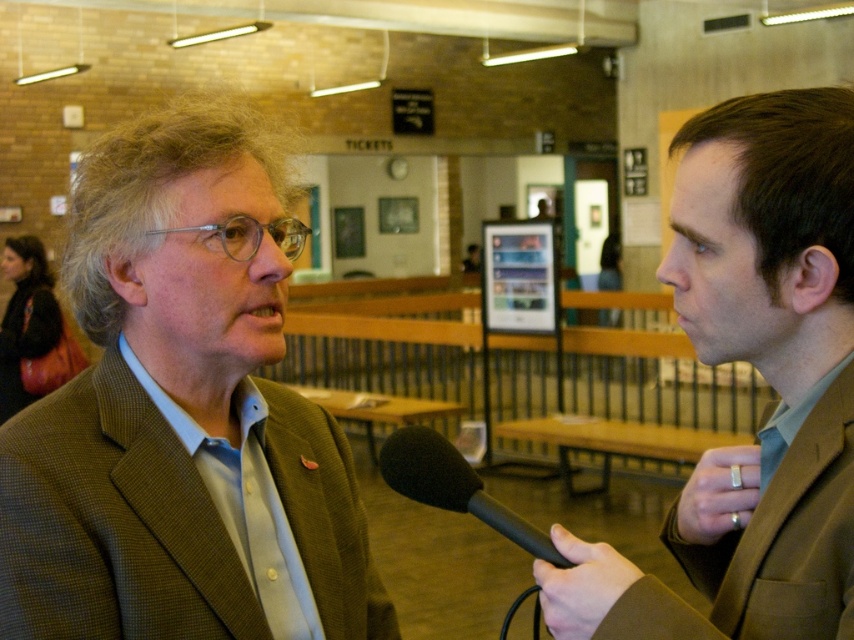
Question: Does green textured blazer at center appear on the right side of black matte microphone at center?

Choices:
 (A) yes
 (B) no

Answer: (B)

Question: Which of the following is the closest to the observer?

Choices:
 (A) (168, 349)
 (B) (717, 604)
 (C) (534, 536)
 (D) (835, 520)

Answer: (D)

Question: Which point is closer to the camera?

Choices:
 (A) black matte microphone at center
 (B) brown wool suit at right

Answer: (B)

Question: Does brown suit at right come in front of brown wool suit at right?

Choices:
 (A) yes
 (B) no

Answer: (B)

Question: Does brown wool suit at right have a lesser width compared to black matte microphone at center?

Choices:
 (A) no
 (B) yes

Answer: (A)

Question: Which of the following is the farthest from the observer?

Choices:
 (A) black matte microphone at center
 (B) brown suit at right

Answer: (A)